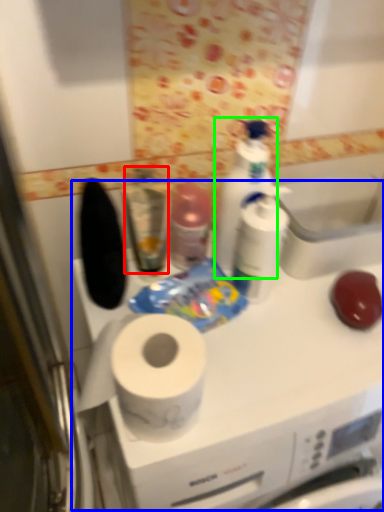
Question: Which object is the farthest from mouthwash (highlighted by a red box)? Choose among these: counter (highlighted by a blue box) or cleaning product (highlighted by a green box).

Choices:
 (A) counter
 (B) cleaning product

Answer: (A)